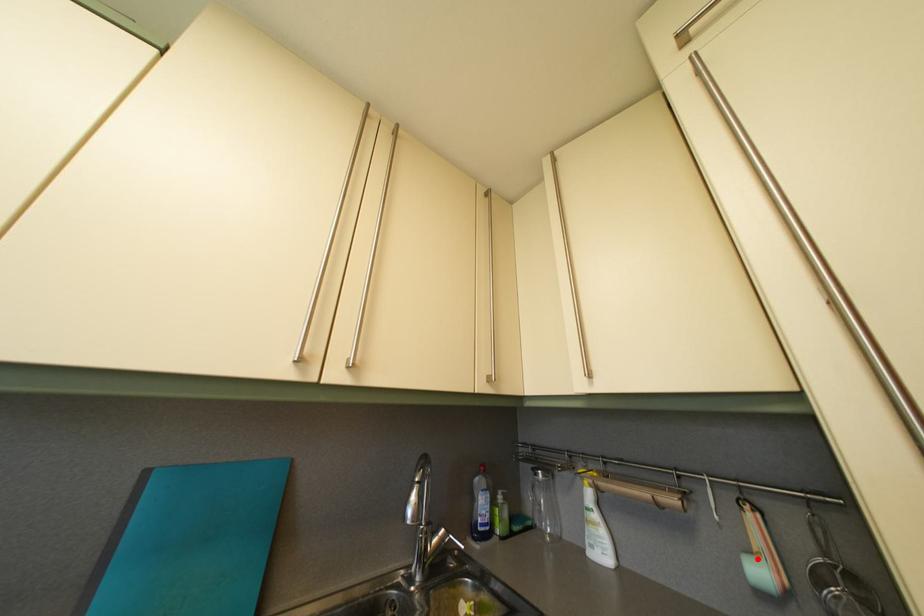
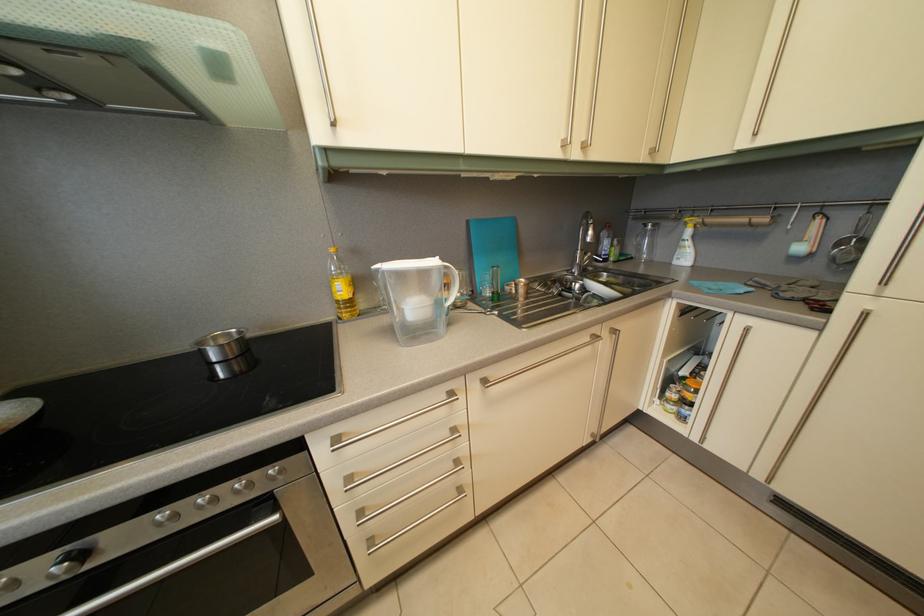
Locate, in the second image, the point that corresponds to the highlighted location in the first image.

(808, 248)